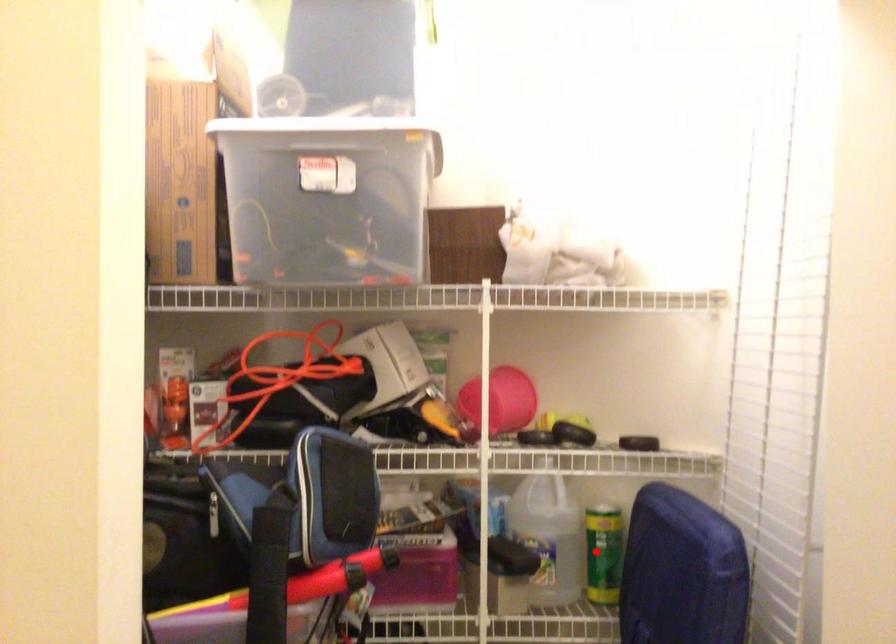
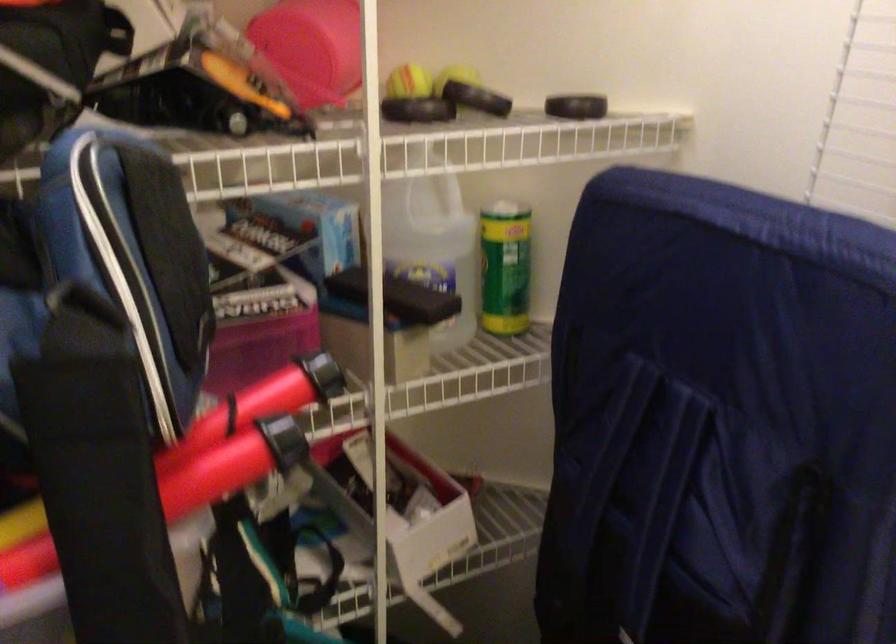
Question: A red point is marked in image1. In image2, is the corresponding 3D point closer to the camera or farther? Reply with the corresponding letter.

Choices:
 (A) The corresponding 3D point is closer.
 (B) The corresponding 3D point is farther.

Answer: (A)